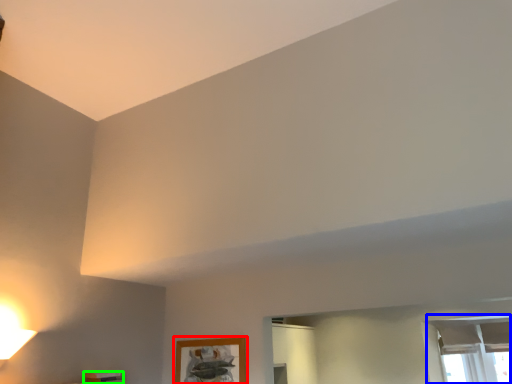
Question: Estimate the real-world distances between objects in this image. Which object is closer to picture frame (highlighted by a red box), window (highlighted by a blue box) or furniture (highlighted by a green box)?

Choices:
 (A) window
 (B) furniture

Answer: (B)